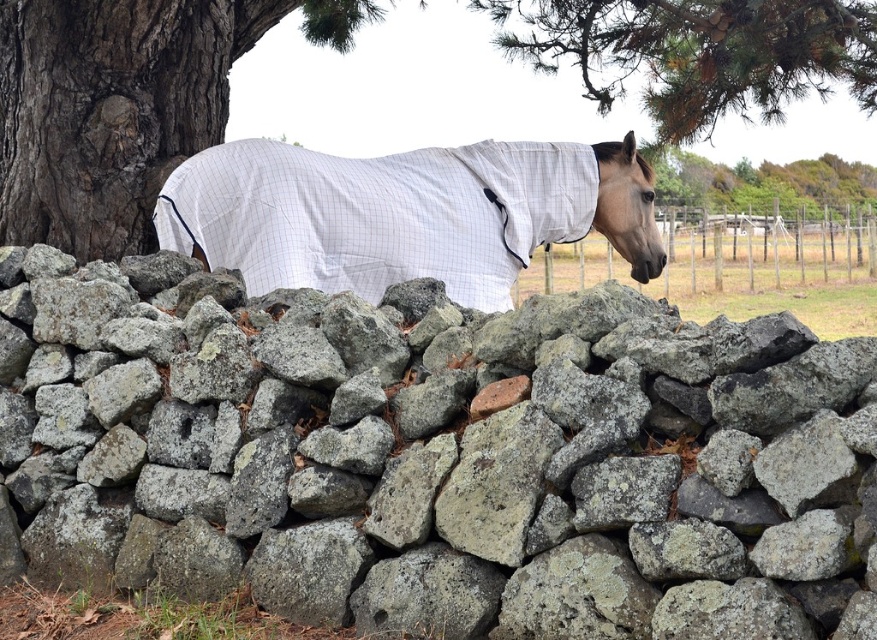
Question: Which of the following is the farthest from the observer?

Choices:
 (A) (380, 193)
 (B) (745, 106)
 (C) (745, 237)

Answer: (C)

Question: Can you confirm if white mesh horse at center is positioned below green leafy tree at upper center?

Choices:
 (A) no
 (B) yes

Answer: (B)

Question: Is green pine needles at upper center to the left of green leafy tree at upper center from the viewer's perspective?

Choices:
 (A) yes
 (B) no

Answer: (A)

Question: Which is nearer to the green leafy tree at upper center?

Choices:
 (A) wooden fence at center
 (B) white mesh horse at center
 (C) green pine needles at upper center
 (D) gray rough stone at center

Answer: (A)

Question: Does white mesh horse at center appear under wooden fence at center?

Choices:
 (A) no
 (B) yes

Answer: (B)

Question: Which object is positioned farthest from the wooden fence at center?

Choices:
 (A) white mesh horse at center
 (B) green pine needles at upper center
 (C) green leafy tree at upper center

Answer: (A)